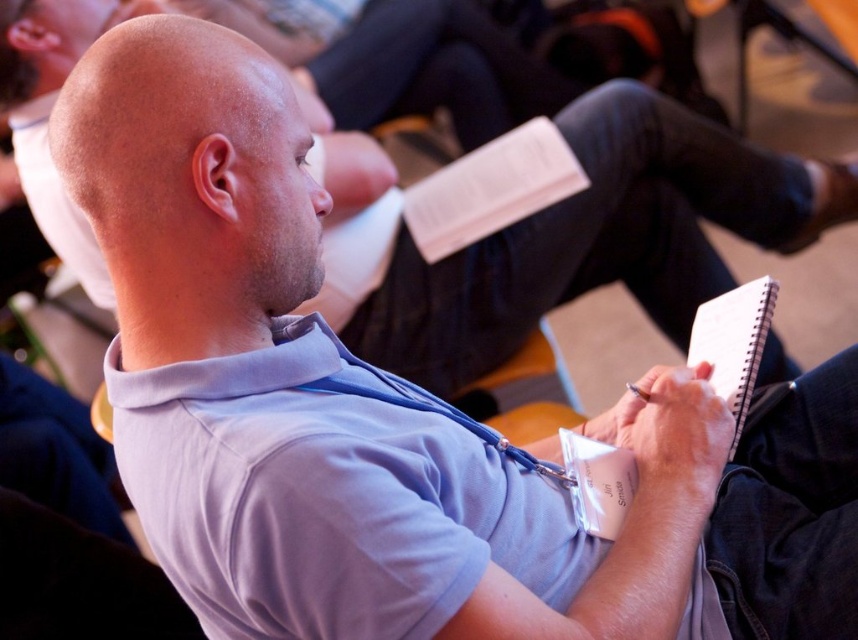
Can you confirm if white paper journal at center is taller than white paper notepad at center?

Indeed, white paper journal at center has a greater height compared to white paper notepad at center.

Does white paper journal at center come behind white paper notepad at center?

Yes, white paper journal at center is further from the viewer.

Between point (436, 252) and point (633, 488), which one is positioned behind?

Positioned behind is point (436, 252).

Locate an element on the screen. Image resolution: width=858 pixels, height=640 pixels. white paper journal at center is located at coordinates (491, 188).

Does white paper journal at center have a lesser width compared to white spiral notebook at lower right?

Incorrect, white paper journal at center's width is not less than white spiral notebook at lower right's.

Who is positioned more to the right, white paper journal at center or white spiral notebook at lower right?

white spiral notebook at lower right is more to the right.

Who is more forward, (511, 154) or (711, 368)?

Positioned in front is point (711, 368).

This screenshot has height=640, width=858. I want to click on white paper journal at center, so click(491, 188).

At what (x,y) coordinates should I click in order to perform the action: click on white spiral notebook at lower right. Please return your answer as a coordinate pair (x, y). The height and width of the screenshot is (640, 858). Looking at the image, I should click on (733, 342).

Consider the image. Can you confirm if white spiral notebook at lower right is shorter than white paper notepad at center?

No, white spiral notebook at lower right is not shorter than white paper notepad at center.

This screenshot has width=858, height=640. In order to click on white spiral notebook at lower right in this screenshot , I will do `click(733, 342)`.